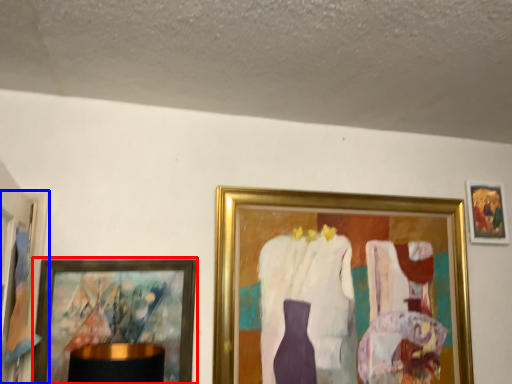
Question: Among these objects, which one is farthest to the camera, picture frame (highlighted by a red box) or picture frame (highlighted by a blue box)?

Choices:
 (A) picture frame
 (B) picture frame

Answer: (A)